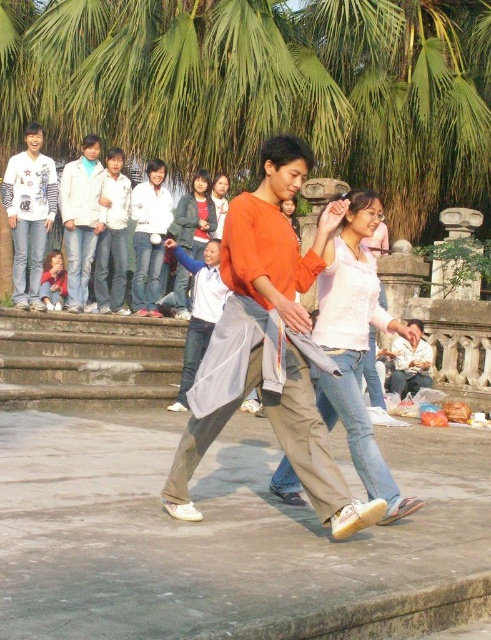
Is point (118, 179) farther from camera compared to point (219, 184)?

No.

Can you confirm if light blue jeans at center is thinner than matte orange shirt at center?

In fact, light blue jeans at center might be wider than matte orange shirt at center.

Which is in front, point (123, 230) or point (219, 211)?

Point (123, 230) is more forward.

In order to click on light blue jeans at center in this screenshot , I will do `click(112, 237)`.

Does matte gray hoodie at center lie behind matte pink shirt at lower left?

That is True.

Does matte gray hoodie at center have a larger size compared to matte pink shirt at lower left?

Correct, matte gray hoodie at center is larger in size than matte pink shirt at lower left.

Who is more forward, (175, 305) or (58, 273)?

Point (58, 273)

Identify the location of matte gray hoodie at center. This screenshot has width=491, height=640. (195, 216).

Who is higher up, white matte jacket at center or matte gray hoodie at center?

Positioned higher is matte gray hoodie at center.

Image resolution: width=491 pixels, height=640 pixels. Find the location of `white matte jacket at center`. white matte jacket at center is located at coordinates (149, 237).